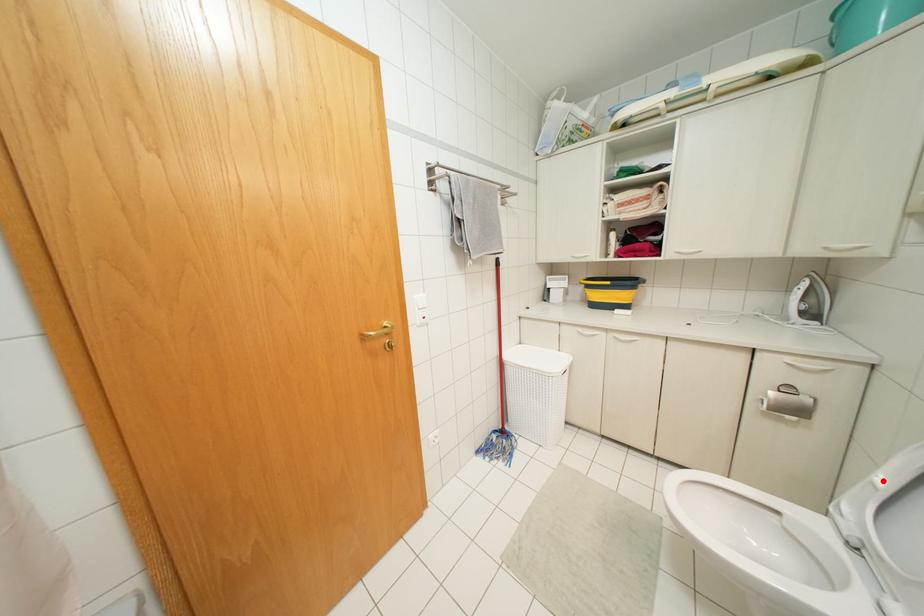
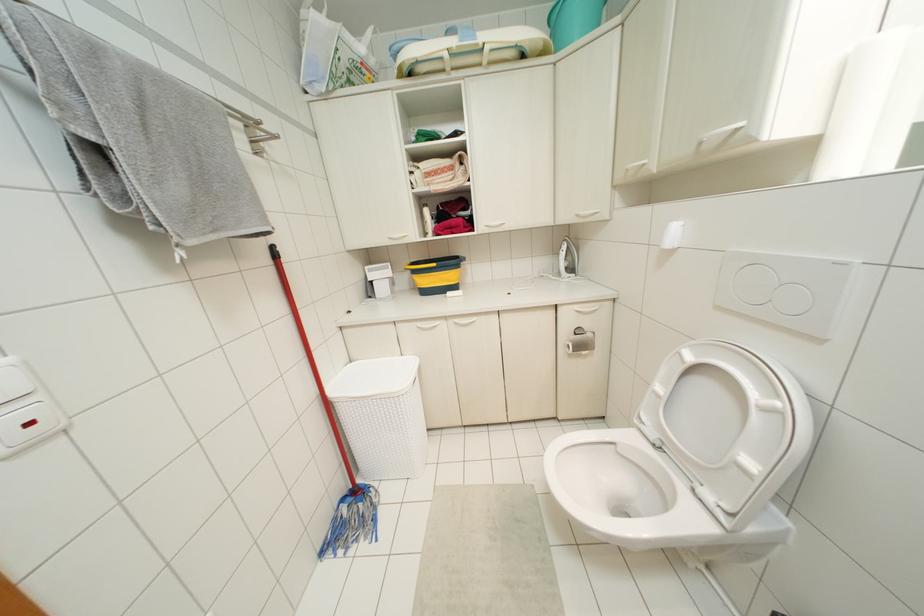
Question: I am providing you with two images of the same scene from different viewpoints. Image1 has a red point marked. In image2, the corresponding 3D location appears at what relative position? Reply with the corresponding letter.

Choices:
 (A) Closer
 (B) Farther

Answer: (A)